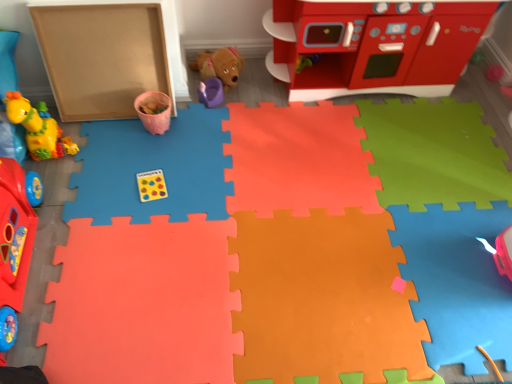
The height and width of the screenshot is (384, 512). Identify the location of vacant space underneath rubber duck at left, which is the seventh toy from right to left (from a real-world perspective). (17, 273).